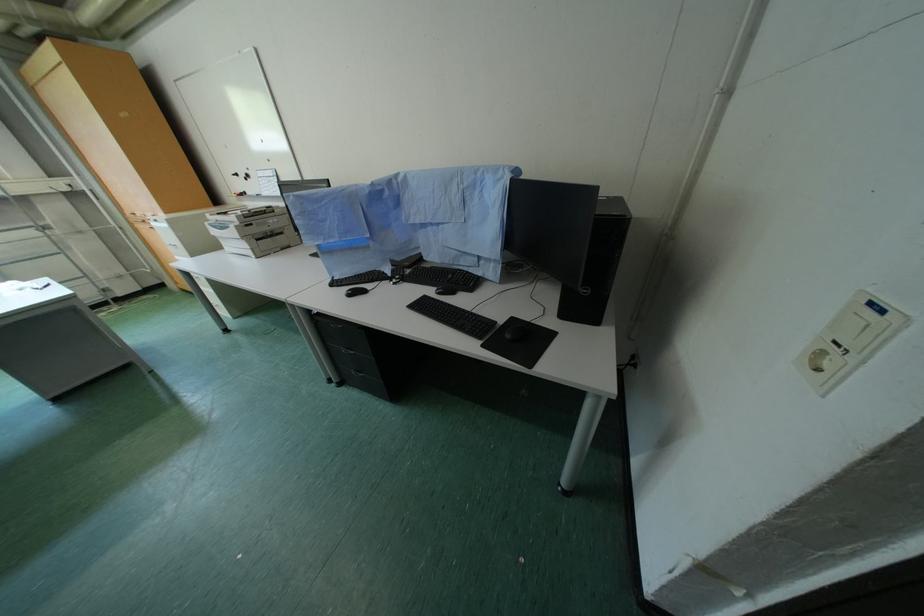
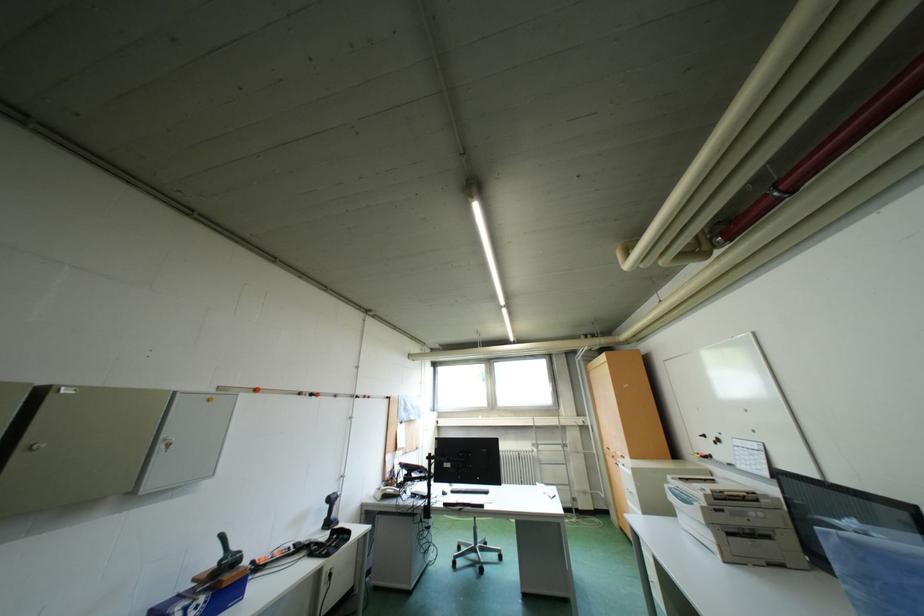
How did the camera likely rotate?

The camera's rotation is toward left-up.